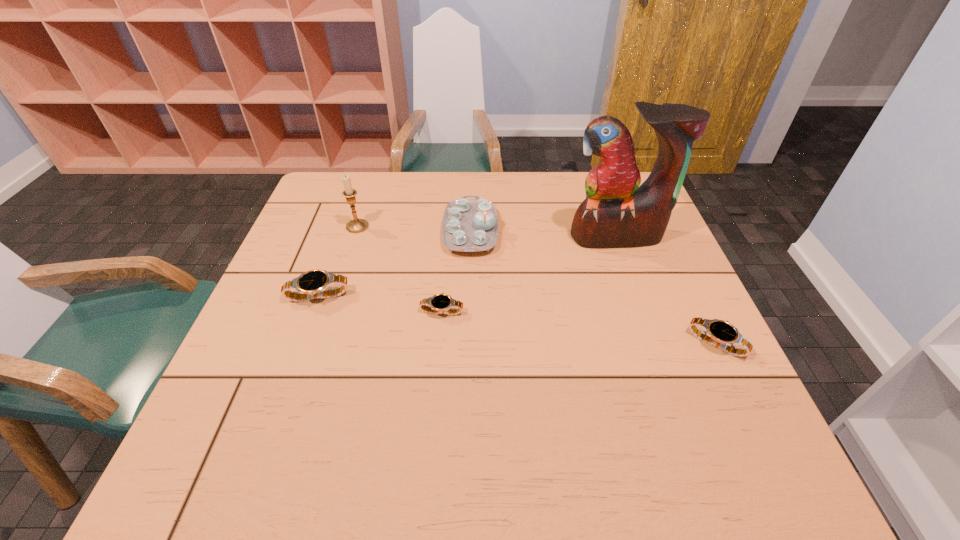
Image resolution: width=960 pixels, height=540 pixels. Identify the location of vacant position located on the back of the shortest watch. click(x=445, y=266).

The height and width of the screenshot is (540, 960). Find the location of `vacant space located 0.220m on the left of the nearest object`. vacant space located 0.220m on the left of the nearest object is located at coordinates (588, 343).

The width and height of the screenshot is (960, 540). I want to click on vacant space located 0.370m on the right of the chinaware, so click(630, 231).

Where is `free space located at the face of the tallest object`? The image size is (960, 540). free space located at the face of the tallest object is located at coordinates tap(626, 263).

You are a GUI agent. You are given a task and a screenshot of the screen. Output one action in this format:
    pyautogui.click(x=<x>, y=<y>)
    Task: Click on the free space located on the back of the candle holder
    
    Given the screenshot: What is the action you would take?
    click(372, 183)

Where is `object present at the far edge`? The image size is (960, 540). object present at the far edge is located at coordinates (469, 225).

Find the location of a particular element. The width and height of the screenshot is (960, 540). watch that is at the left edge is located at coordinates (311, 285).

What are the coordinates of `candle holder that is at the left edge` in the screenshot? It's located at (356, 225).

This screenshot has width=960, height=540. Find the location of `watch located in the right edge section of the desktop`. watch located in the right edge section of the desktop is located at coordinates (721, 334).

The height and width of the screenshot is (540, 960). I want to click on parrot located in the right edge section of the desktop, so click(x=617, y=212).